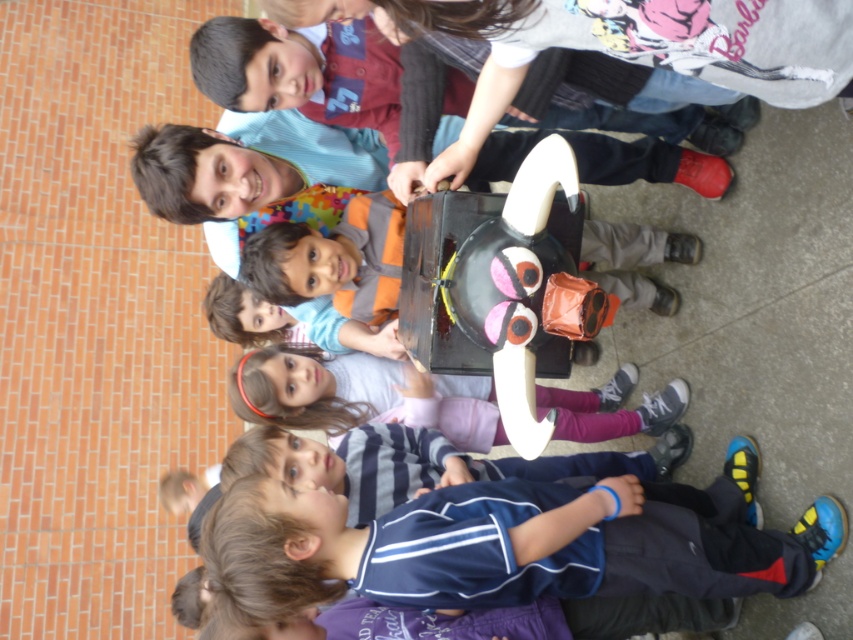
Question: Which of the following is the farthest from the observer?

Choices:
 (A) (364, 84)
 (B) (294, 129)

Answer: (B)

Question: Does matte black backpack at upper center appear on the left side of striped cotton shirt at lower center?

Choices:
 (A) yes
 (B) no

Answer: (B)

Question: Does matte black backpack at upper center come in front of pink fabric dress at center?

Choices:
 (A) yes
 (B) no

Answer: (A)

Question: Which object is the closest to the striped cotton shirt at lower center?

Choices:
 (A) matte orange shirt at center
 (B) pink fabric dress at center
 (C) matte black backpack at upper center

Answer: (B)

Question: Does matte black backpack at upper center come behind matte orange shirt at center?

Choices:
 (A) no
 (B) yes

Answer: (A)

Question: Which object is positioned farthest from the striped cotton shirt at lower center?

Choices:
 (A) matte black backpack at upper center
 (B) pink fabric dress at center
 (C) matte orange shirt at center

Answer: (A)